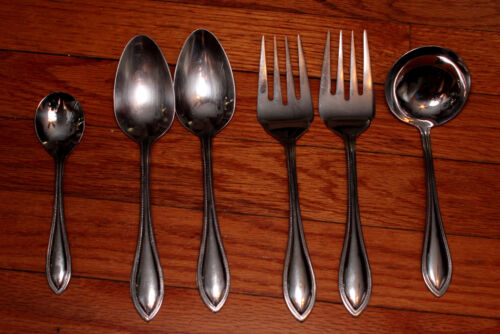
In order to click on utensils in this screenshot , I will do `click(61, 262)`, `click(162, 288)`, `click(210, 282)`, `click(292, 277)`, `click(352, 270)`, `click(433, 256)`.